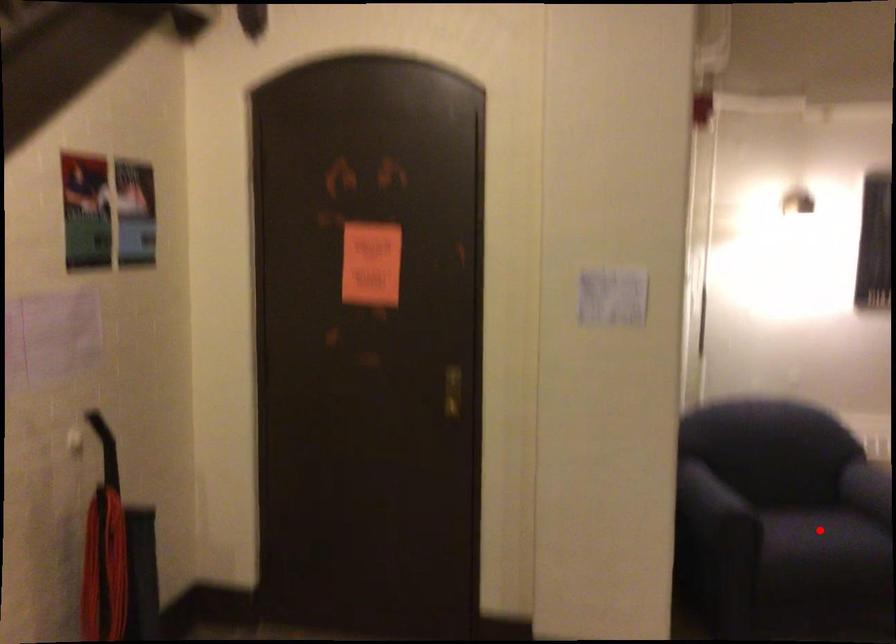
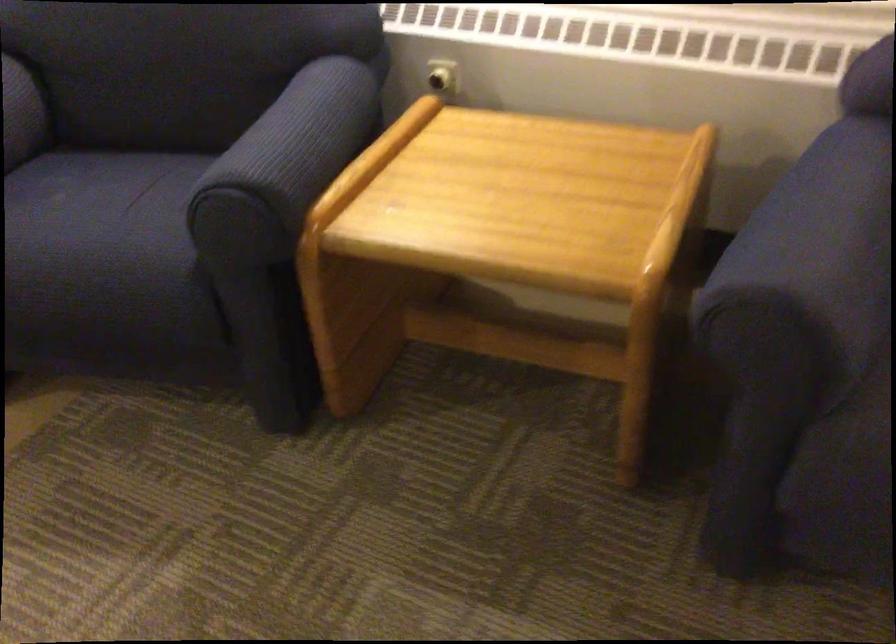
Locate, in the second image, the point that corresponds to the highlighted location in the first image.

(99, 232)